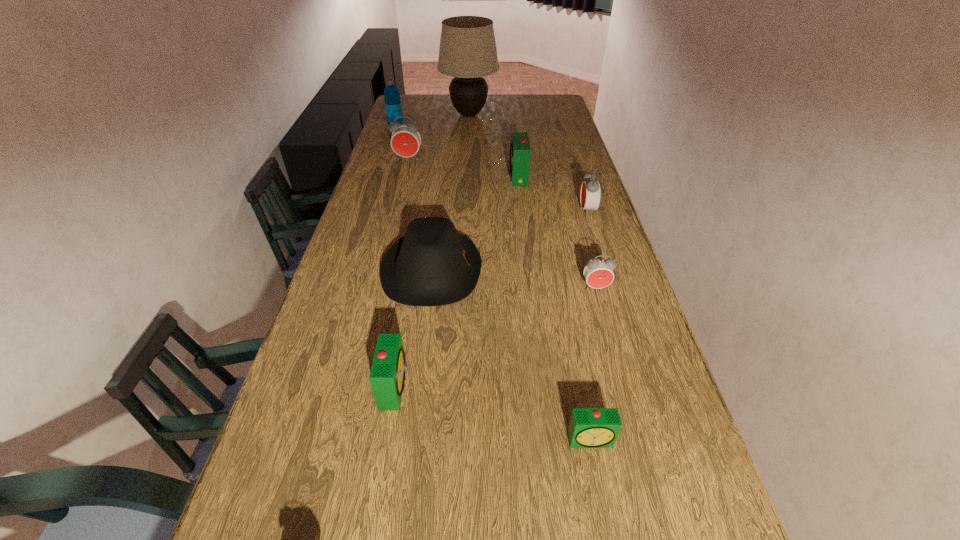
Identify the location of the tallest object. (467, 51).

What are the coordinates of `the leftmost object` in the screenshot? It's located at (392, 98).

Find the location of a particular element. Image resolution: width=960 pixels, height=540 pixels. the biggest red alarm clock is located at coordinates (405, 141).

The height and width of the screenshot is (540, 960). What are the coordinates of `the leftmost alarm clock` in the screenshot? It's located at (405, 141).

The width and height of the screenshot is (960, 540). In order to click on the fifth farthest object in this screenshot , I will do `click(591, 192)`.

Where is `the second smallest red alarm clock`? This screenshot has height=540, width=960. the second smallest red alarm clock is located at coordinates (591, 192).

Identify the location of the fourth alarm clock from right to left. Image resolution: width=960 pixels, height=540 pixels. tap(520, 150).

What are the coordinates of `the sixth nearest object` in the screenshot? It's located at (520, 150).

The height and width of the screenshot is (540, 960). What are the coordinates of `fedora` in the screenshot? It's located at (431, 265).

Image resolution: width=960 pixels, height=540 pixels. Identify the location of the smallest red alarm clock. point(598,273).